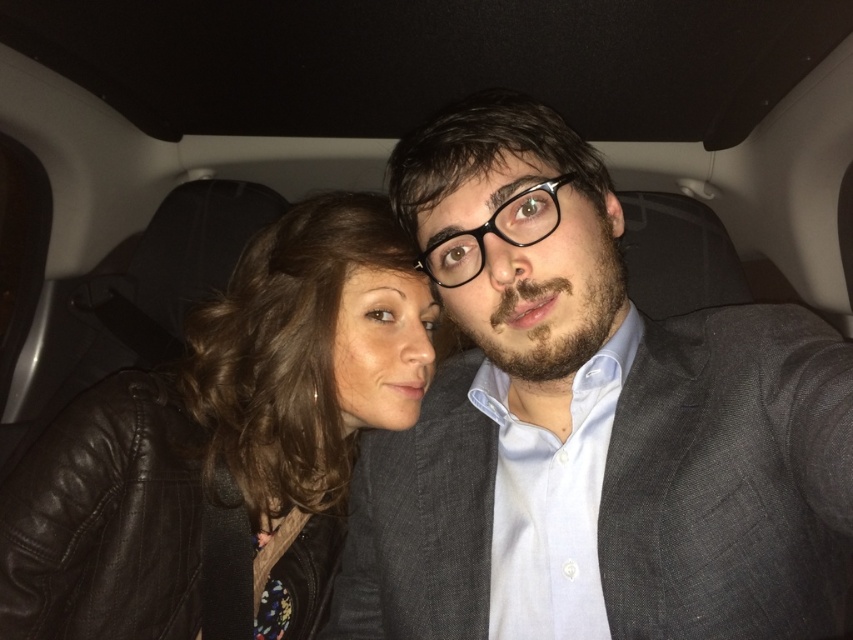
You are a photographer setting up a shoot in a car. You have two subjects wearing the gray textured suit at center and the black leather jacket at left. To ensure proper lighting, you need to know their positions relative to each other. Which subject is positioned to the right of the other?

The gray textured suit at center is positioned to the right of the black leather jacket at left.

You are a tailor who needs to determine which garment requires more fabric for alterations. Based on the image, which of the two garments, the gray textured suit at center or the black leather jacket at left, would need more fabric due to its larger size?

The gray textured suit at center requires more fabric because its width surpasses that of the black leather jacket at left.

You are a photographer trying to capture a closeup shot of the gray textured suit at center from your current position. Given that your camera lens has a minimum focusing distance of 18 inches, will you be able to take the photo without moving closer?

The distance between the gray textured suit at center and the camera is 17.91 inches, which is slightly less than the minimum focusing distance of 18 inches. Therefore, you will not be able to take the photo without moving further away or adjusting your position to increase the distance.